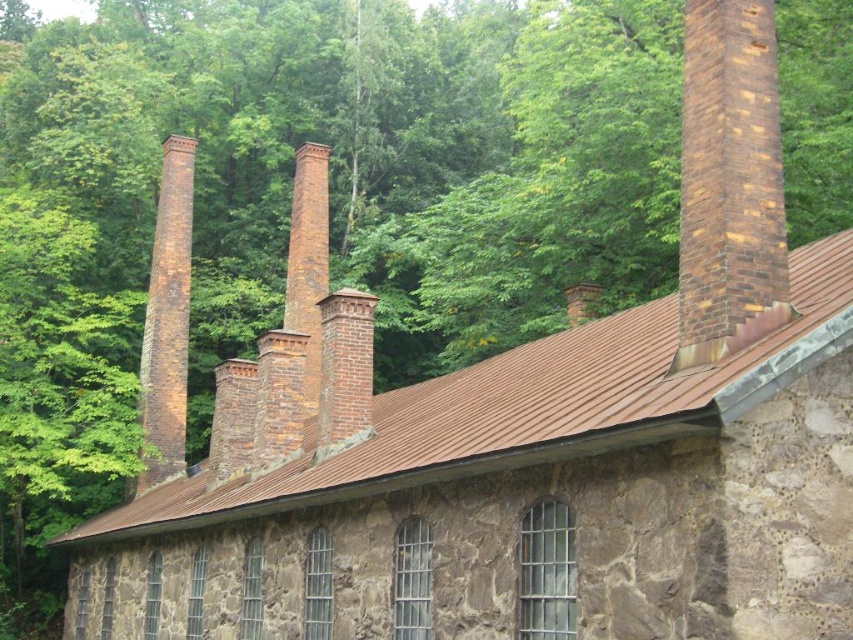
You are standing in front of the stone building with the rusted metal roof. You notice two brown brick chimneys. Which one is closer to you, the brown brick chimney at upper right or the brown brick chimney at left?

The brown brick chimney at upper right is closer to the viewer than the brown brick chimney at left.

You are standing directly in front of the stone building with a rusted metal roof. Looking at the building, where is the brown brick chimney at upper right located in terms of its position on the roof?

The brown brick chimney at upper right is located at the coordinates point (729,182) on the roof.